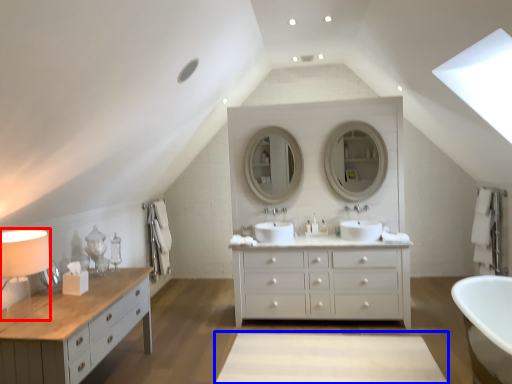
Question: Which object is closer to the camera taking this photo, table lamp (highlighted by a red box) or plain (highlighted by a blue box)?

Choices:
 (A) table lamp
 (B) plain

Answer: (A)